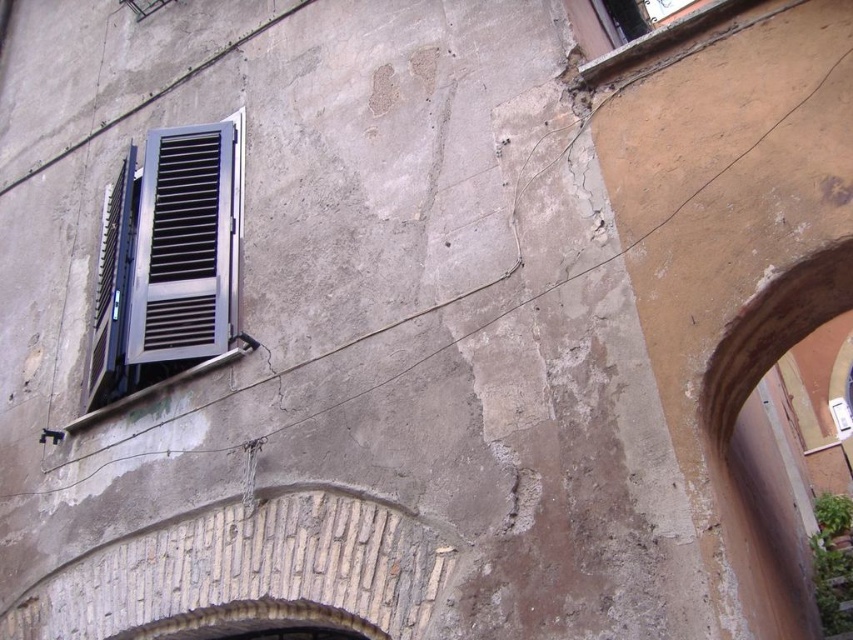
Question: Is metallic gray window at left smaller than metallic silver shutter at left?

Choices:
 (A) yes
 (B) no

Answer: (B)

Question: Which is nearer to the metallic gray window at left?

Choices:
 (A) smooth stone archway at center
 (B) metallic silver shutter at left

Answer: (B)

Question: Is metallic gray window at left wider than smooth stone archway at center?

Choices:
 (A) yes
 (B) no

Answer: (A)

Question: Which of the following is the closest to the observer?

Choices:
 (A) metallic silver shutter at left
 (B) metallic gray window at left

Answer: (B)

Question: Is metallic silver shutter at left further to the viewer compared to smooth stone archway at center?

Choices:
 (A) yes
 (B) no

Answer: (A)

Question: Which of the following is the closest to the observer?

Choices:
 (A) (709, 440)
 (B) (180, 186)

Answer: (A)